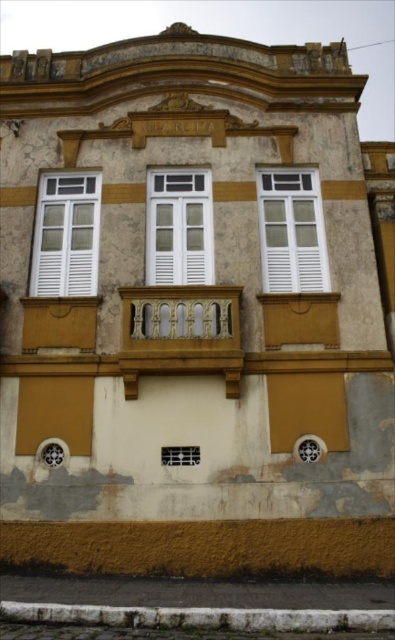
Image resolution: width=395 pixels, height=640 pixels. Identify the location of white matte window at left. (67, 234).

Between point (54, 211) and point (317, 252), which one is positioned in front?

Point (317, 252)

Identify the location of white matte window at left. (67, 234).

Is white matte window at center bigger than white matte shutter at lower left?

Correct, white matte window at center is larger in size than white matte shutter at lower left.

The image size is (395, 640). I want to click on white matte window at center, so click(x=291, y=230).

Locate an element on the screen. The height and width of the screenshot is (640, 395). white matte window at center is located at coordinates (291, 230).

Which is more to the right, white painted wood window at center or matte white shutter at center?

matte white shutter at center is more to the right.

Who is more distant from viewer, (x=182, y=248) or (x=344, y=396)?

The point (x=182, y=248) is behind.

At what (x,y) coordinates should I click in order to perform the action: click on white painted wood window at center. Please return your answer as a coordinate pair (x, y). This screenshot has height=640, width=395. Looking at the image, I should click on (178, 227).